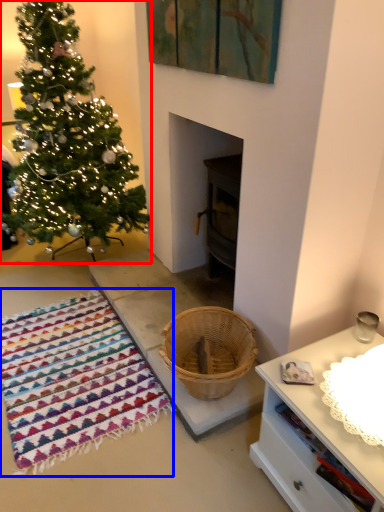
Question: Which of the following is the closest to the observer, christmas tree (highlighted by a red box) or blanket (highlighted by a blue box)?

Choices:
 (A) christmas tree
 (B) blanket

Answer: (B)